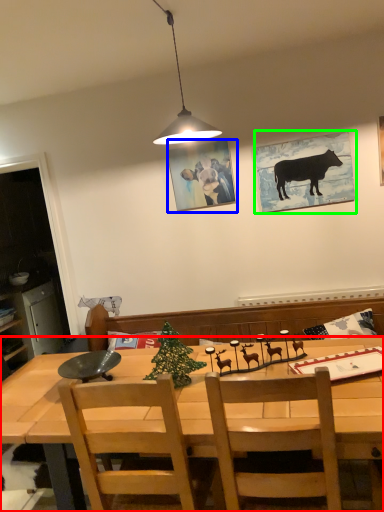
Question: Considering the real-world distances, which object is farthest from desk (highlighted by a red box)? picture frame (highlighted by a blue box) or picture frame (highlighted by a green box)?

Choices:
 (A) picture frame
 (B) picture frame

Answer: (A)